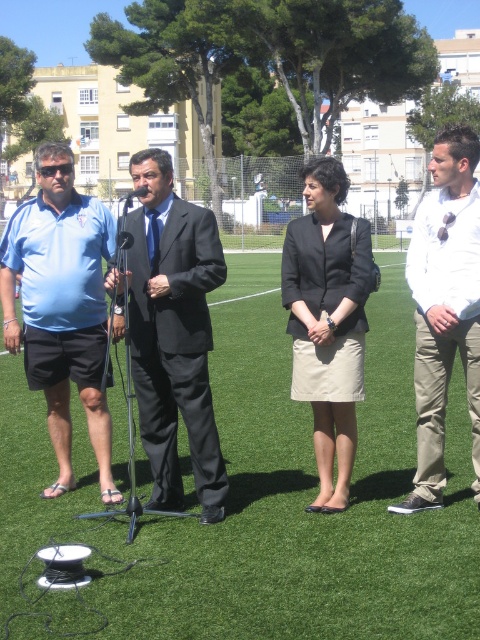
Question: From the image, what is the correct spatial relationship of dark gray blazer at center in relation to black plastic microphone at center?

Choices:
 (A) right
 (B) left

Answer: (A)

Question: Considering the real-world distances, which object is farthest from the dark gray blazer at center?

Choices:
 (A) green artificial turf at lower center
 (B) white cotton shirt at right
 (C) black plastic microphone at center
 (D) black suit at center

Answer: (C)

Question: Which of these objects is positioned closest to the white cotton shirt at right?

Choices:
 (A) dark gray blazer at center
 (B) matte blue shirt at left
 (C) green artificial turf at lower center
 (D) black suit at center

Answer: (A)

Question: Where is matte blue shirt at left located in relation to black plastic microphone at center in the image?

Choices:
 (A) right
 (B) left

Answer: (A)

Question: Which point is farther from the camera taking this photo?

Choices:
 (A) (376, 600)
 (B) (126, 202)
 (C) (357, 372)

Answer: (C)

Question: Is white cotton shirt at right closer to camera compared to black plastic microphone at center?

Choices:
 (A) no
 (B) yes

Answer: (B)